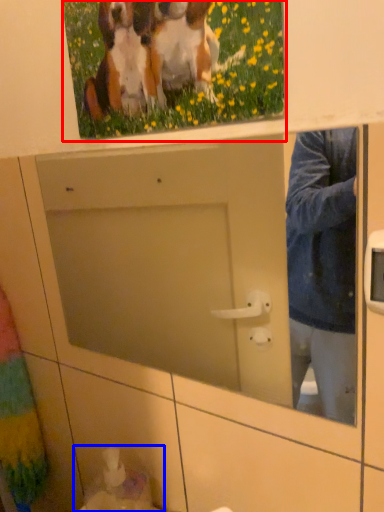
Question: Which object is further to the camera taking this photo, picture frame (highlighted by a red box) or sink (highlighted by a blue box)?

Choices:
 (A) picture frame
 (B) sink

Answer: (B)